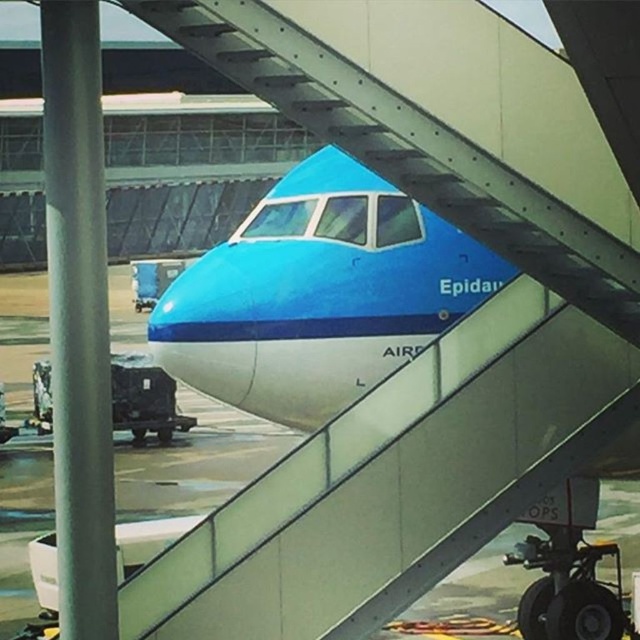
Does blue glossy airplane at center have a greater height compared to metallic gray staircase at center?

No.

Measure the distance between point (387, 253) and camera.

The distance of point (387, 253) from camera is 28.79 feet.

Is point (269, 218) more distant than point (636, 284)?

Yes, it is.

Find the location of a particular element. The height and width of the screenshot is (640, 640). blue glossy airplane at center is located at coordinates (317, 294).